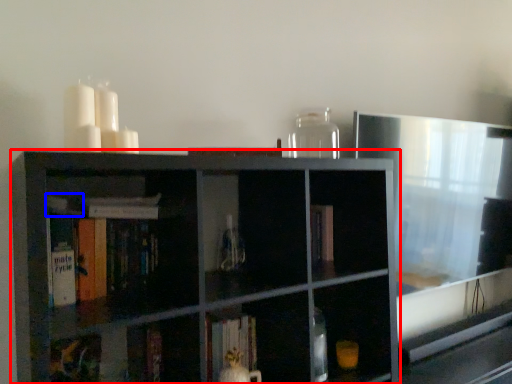
Question: Which object appears farthest to the camera in this image, shelf (highlighted by a red box) or book (highlighted by a blue box)?

Choices:
 (A) shelf
 (B) book

Answer: (B)